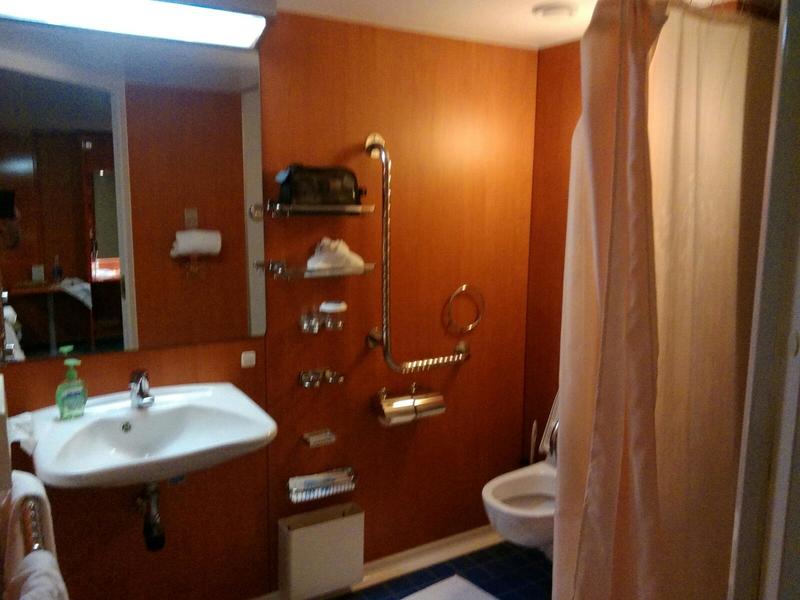
At what (x,y) coordinates should I click in order to perform the action: click on chrome ring towel holder. Please return your answer as a coordinate pair (x, y). The image size is (800, 600). Looking at the image, I should click on (464, 328).